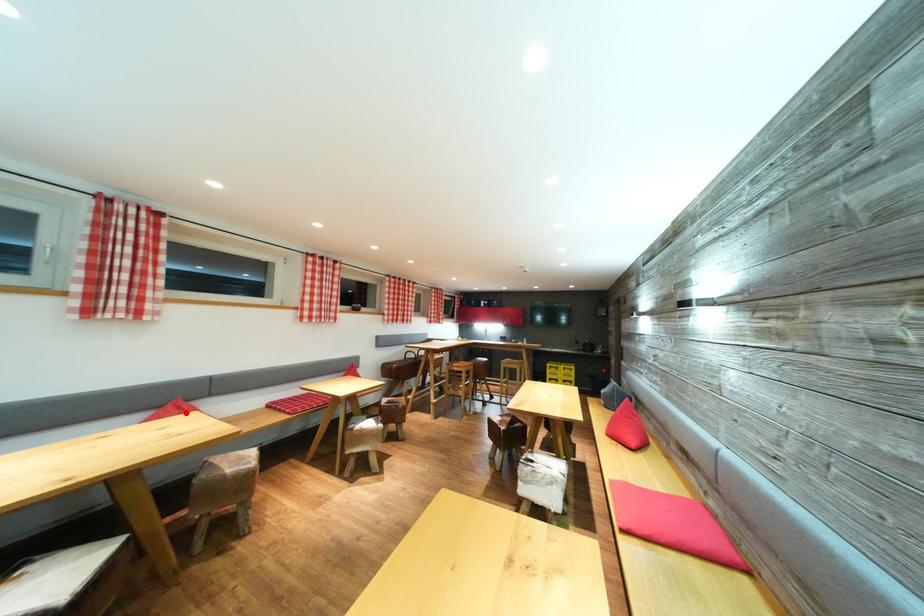
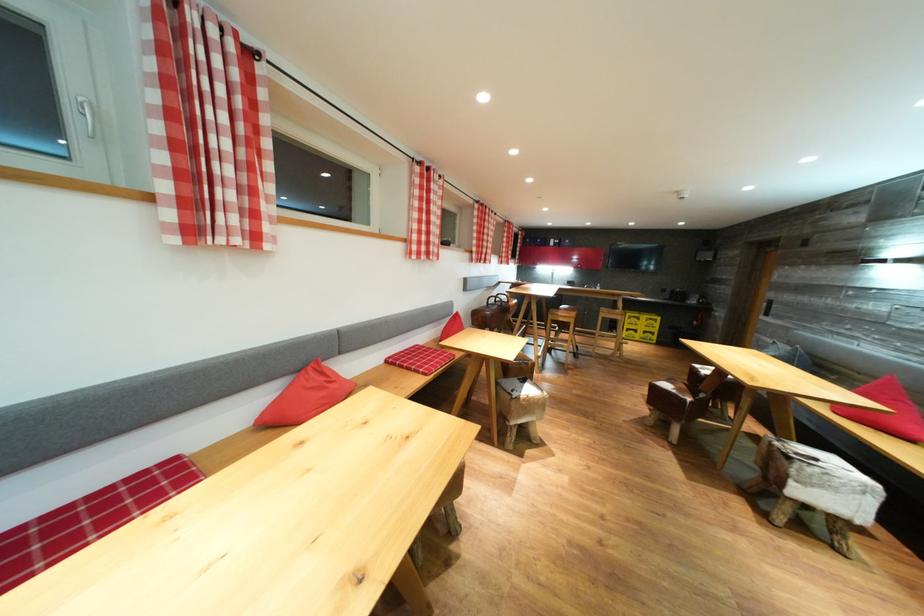
Question: I am providing you with two images of the same scene from different viewpoints. A red point is marked on the first image. Is the red point's position out of view in image 2?

Choices:
 (A) Yes
 (B) No

Answer: (B)